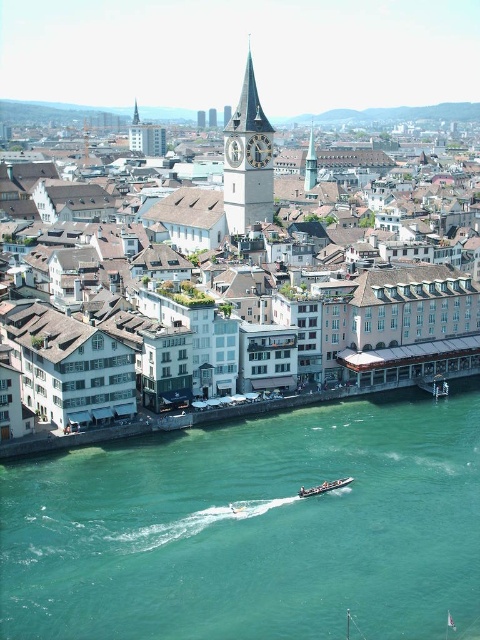
Question: Which of the following is the closest to the observer?

Choices:
 (A) [x=312, y=166]
 (B) [x=249, y=163]
 (C) [x=92, y=506]
 (D) [x=386, y=124]

Answer: (C)

Question: Does teal glossy water at lower center appear over metallic silver boat at lower center?

Choices:
 (A) no
 (B) yes

Answer: (B)

Question: Among these points, which one is farthest from the camera?

Choices:
 (A) (460, 256)
 (B) (225, 131)
 (C) (298, 492)

Answer: (B)

Question: Is white textured building at center positioned at the back of white stone clock tower at center?

Choices:
 (A) yes
 (B) no

Answer: (B)

Question: Which object is positioned closest to the white textured building at center?

Choices:
 (A) teal glossy water at lower center
 (B) smooth stone clock tower at center
 (C) metallic silver boat at lower center
 (D) white stone clock tower at center

Answer: (D)

Question: Can you confirm if white stone clock tower at center is bigger than metallic silver boat at lower center?

Choices:
 (A) yes
 (B) no

Answer: (A)